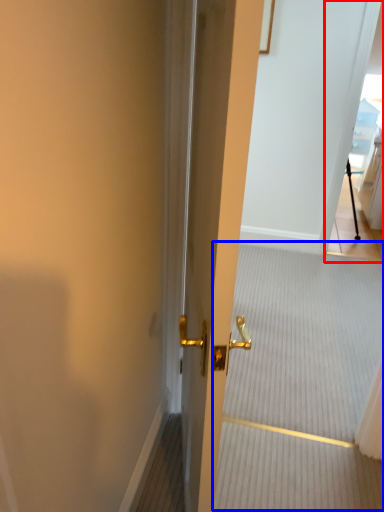
Question: Which point is further to the camera, glass door (highlighted by a red box) or stair (highlighted by a blue box)?

Choices:
 (A) glass door
 (B) stair

Answer: (A)